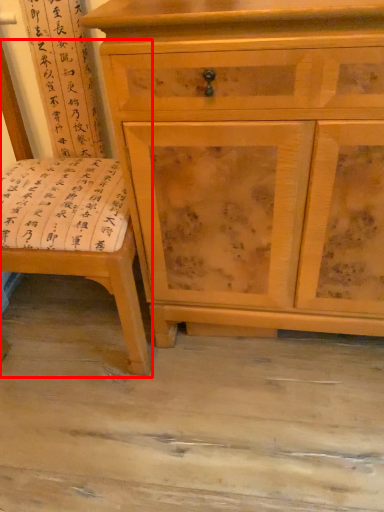
Question: From the image's perspective, where is swivel chair (annotated by the red box) located in relation to chest of drawers in the image?

Choices:
 (A) above
 (B) below

Answer: (B)